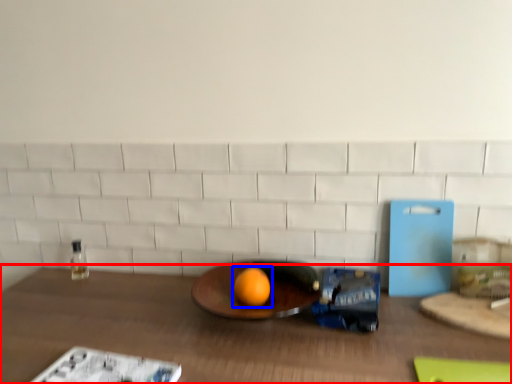
Question: Which object appears closest to the camera in this image, table (highlighted by a red box) or grapefruit (highlighted by a blue box)?

Choices:
 (A) table
 (B) grapefruit

Answer: (A)